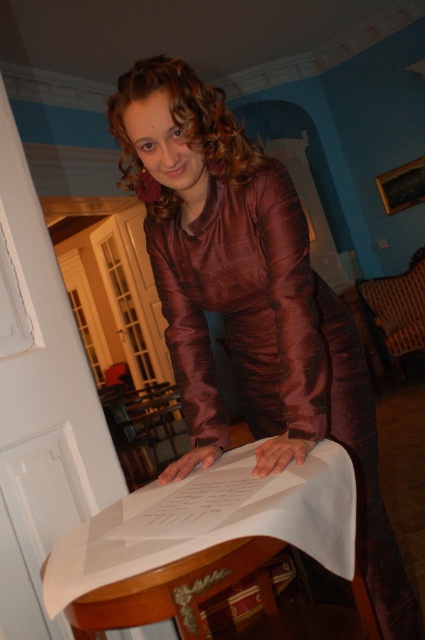
You are a photographer setting up for a photoshoot. You have a matte purple dress at center and a camera. The subject is wearing the dress and standing at center. You want to take a full body shot. What distance should you set your camera from the subject to capture the entire body?

The matte purple dress at center and camera are 1.02 meters apart, so you should set the camera at 1.02 meters away from the subject to capture the full body shot.

From the picture: You are an interior designer analyzing the placement of objects in the room. The woman in the image is wearing a matte purple dress at center. According to the coordinates provided, is the dress positioned closer to the top or bottom half of the image?

The 2D location of the matte purple dress at center is at point (249, 300), so the dress is positioned closer to the bottom half of the image.

In the scene shown: You are an interior designer observing the image. You need to place a small decorative item exactly at the point with coordinates point (249, 300). Which object from the scene will this item be placed on?

The point (249, 300) is on the matte purple dress at center, so the decorative item will be placed on the matte purple dress at center.